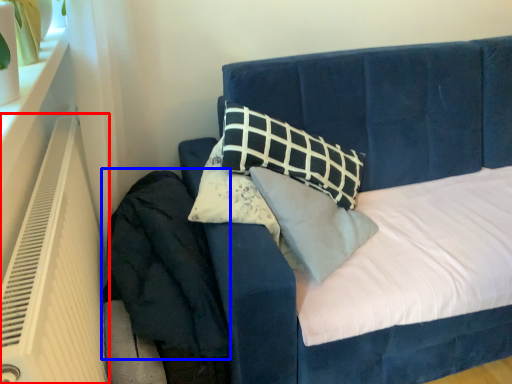
Question: Which of the following is the closest to the observer, heater (highlighted by a red box) or velvet (highlighted by a blue box)?

Choices:
 (A) heater
 (B) velvet

Answer: (A)